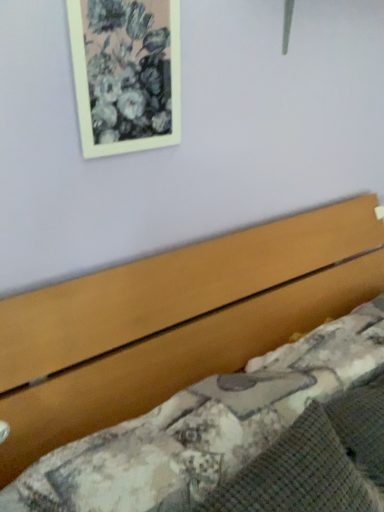
Question: Is matte white picture frame at upper left inside the boundaries of wooden bed at lower right, or outside?

Choices:
 (A) outside
 (B) inside

Answer: (A)

Question: In terms of height, does matte white picture frame at upper left look taller or shorter compared to wooden bed at lower right?

Choices:
 (A) tall
 (B) short

Answer: (B)

Question: From a real-world perspective, relative to wooden bed at lower right, is matte white picture frame at upper left vertically above or below?

Choices:
 (A) below
 (B) above

Answer: (B)

Question: Considering the positions of wooden bed at lower right and matte white picture frame at upper left in the image, is wooden bed at lower right taller or shorter than matte white picture frame at upper left?

Choices:
 (A) short
 (B) tall

Answer: (B)

Question: Would you say wooden bed at lower right is inside or outside matte white picture frame at upper left?

Choices:
 (A) inside
 (B) outside

Answer: (B)

Question: Looking at the image, does wooden bed at lower right seem bigger or smaller compared to matte white picture frame at upper left?

Choices:
 (A) small
 (B) big

Answer: (B)

Question: From the image's perspective, is wooden bed at lower right above or below matte white picture frame at upper left?

Choices:
 (A) above
 (B) below

Answer: (B)